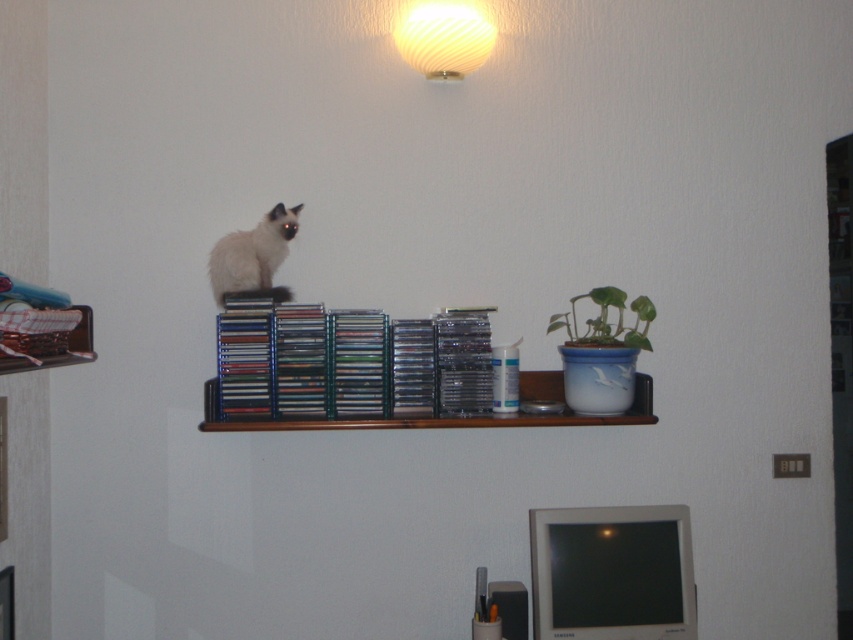
Question: Which point is farther from the camera taking this photo?

Choices:
 (A) (231, 246)
 (B) (445, 51)
 (C) (643, 310)
 (D) (259, 333)

Answer: (C)

Question: Which object appears farthest from the camera in this image?

Choices:
 (A) white ribbed glass lamp at upper center
 (B) metallic silver shelf at upper left
 (C) green glossy leafy plant at upper right
 (D) smokey white fur at upper center

Answer: (A)

Question: Can you confirm if smokey white fur at upper center is thinner than metallic silver shelf at upper left?

Choices:
 (A) yes
 (B) no

Answer: (B)

Question: Which of the following is the closest to the observer?

Choices:
 (A) (442, 388)
 (B) (236, 268)
 (C) (403, 24)

Answer: (A)

Question: Does brown wooden shelf at center have a larger size compared to smokey white fur at upper center?

Choices:
 (A) yes
 (B) no

Answer: (A)

Question: In this image, where is brown wooden shelf at center located relative to metallic silver shelf at upper left?

Choices:
 (A) left
 (B) right

Answer: (B)